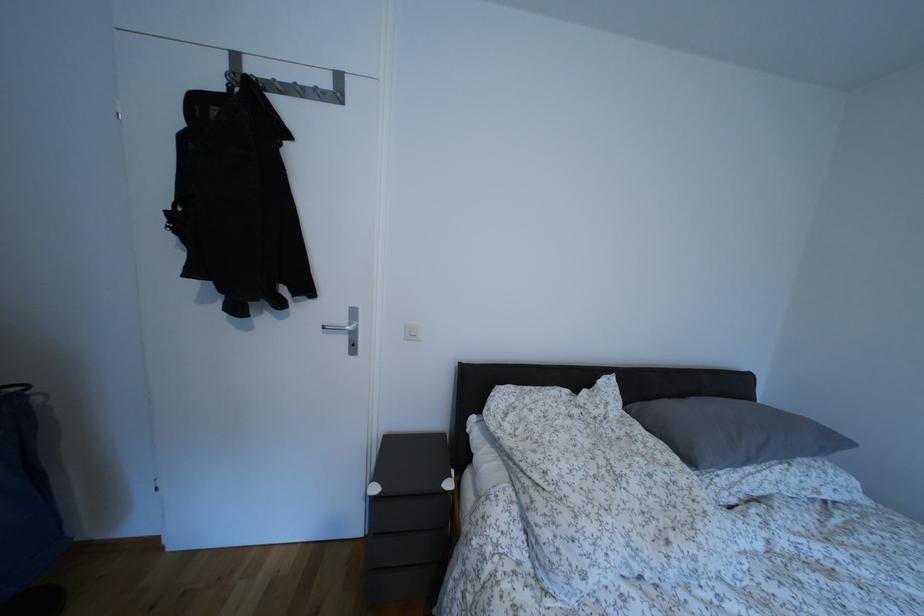
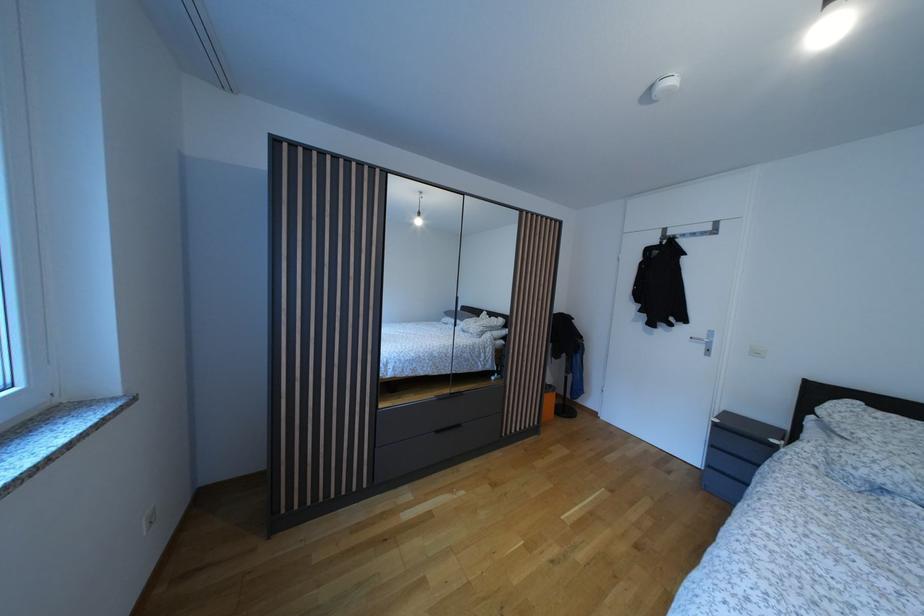
In the second image, find the point that corresponds to point (382, 495) in the first image.

(723, 427)